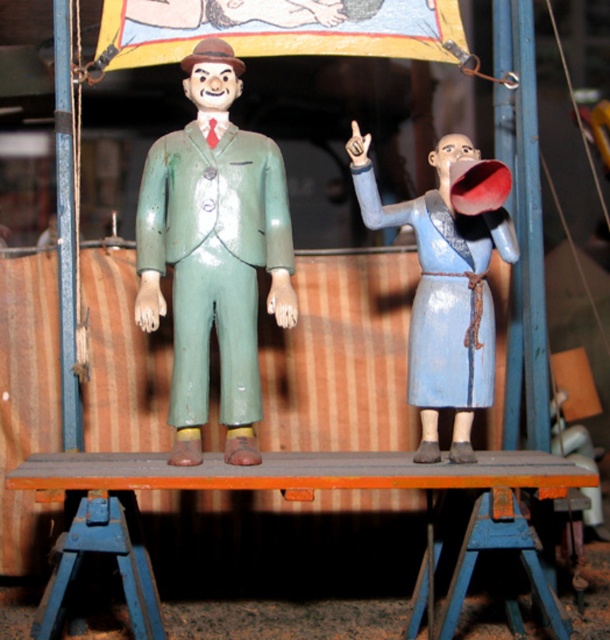
You are a stagehand setting up a small theater scene. You need to place a 6.5 inch wide decorative box between the green painted wood figure at center and the blue matte megaphone at right. Can you fit the box between them?

The distance between the green painted wood figure at center and the blue matte megaphone at right is 5.94 inches, which is less than the 6.5 inch width of the box. Therefore, the box cannot fit between them.

You are an event organizer setting up a stage for a vintage performance. You have a green painted wood figure at center and a blue matte megaphone at right. Which object requires a wider space to display properly?

The blue matte megaphone at right requires a wider space to display properly because its width is greater than the green painted wood figure at center.